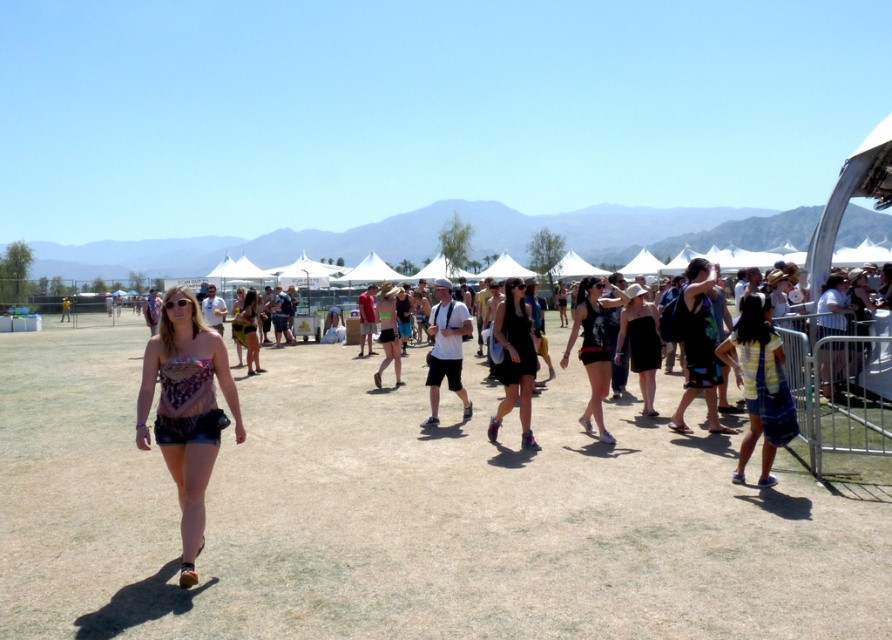
Question: Among these objects, which one is nearest to the camera?

Choices:
 (A) black matte dress at center
 (B) brown dry grass at center

Answer: (B)

Question: Can you confirm if multicolored fabric dress at right is smaller than matte black tank top at center?

Choices:
 (A) no
 (B) yes

Answer: (A)

Question: Based on their relative distances, which object is farther from the white cotton t-shirt at center?

Choices:
 (A) denim shorts at center
 (B) matte brown dress at center
 (C) matte black tank top at center
 (D) brown dry grass at center

Answer: (B)

Question: Is brown dry grass at center to the left of matte black shorts at center from the viewer's perspective?

Choices:
 (A) no
 (B) yes

Answer: (B)

Question: Which object appears closest to the camera in this image?

Choices:
 (A) matte black shorts at center
 (B) multicolored fabric dress at right

Answer: (B)

Question: Can you confirm if blue striped dress at right is smaller than matte brown dress at center?

Choices:
 (A) no
 (B) yes

Answer: (B)